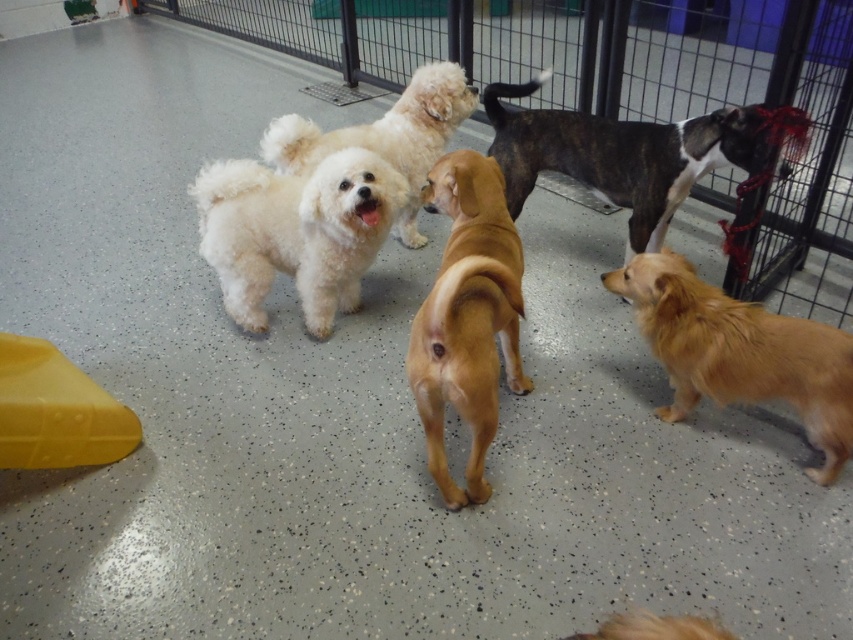
Question: Does metallic wire cage at center appear under fluffy white dog at center?

Choices:
 (A) no
 (B) yes

Answer: (A)

Question: Considering the real-world distances, which object is farthest from the golden fur dog at lower right?

Choices:
 (A) brindle fur dog at center
 (B) fluffy white dog at center
 (C) metallic wire cage at center

Answer: (C)

Question: Does white fluffy dog at center appear on the right side of brown smooth dog at center?

Choices:
 (A) yes
 (B) no

Answer: (B)

Question: Which of the following is the farthest from the observer?

Choices:
 (A) golden fur dog at lower right
 (B) metallic wire cage at center
 (C) brindle fur dog at center
 (D) brown smooth dog at center

Answer: (B)

Question: Can you confirm if white fluffy dog at center is smaller than brown smooth dog at center?

Choices:
 (A) no
 (B) yes

Answer: (B)

Question: Which point is farther to the camera?

Choices:
 (A) metallic wire cage at center
 (B) brown smooth dog at center
 (C) brindle fur dog at center
 (D) white fluffy dog at center

Answer: (A)